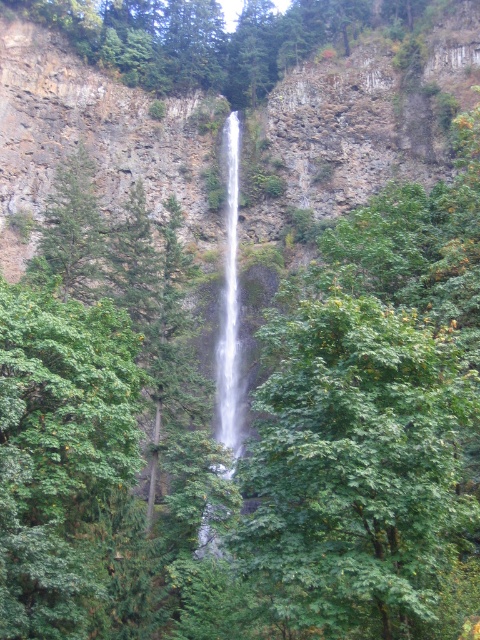
You are a drone operator trying to capture the waterfall. Your drone is currently at the coordinates where the clear water at center is located. You need to move it 0.1 units to the right and 0.1 units down. What are the new coordinates?

The clear water at center is at point (229, 308). Moving 0.1 units to the right increases the x coordinate to 0.584, and moving 0.1 units down increases the y coordinate to 0.579. The new coordinates are (277, 372).

You are a hiker standing near the base of the waterfall. You want to place a 60 cm long measuring stick horizontally between the clear water at center and the white smooth waterfall at center. Will the measuring stick fit without overlapping either object?

The clear water at center is 59.90 centimeters from the white smooth waterfall at center. Since the measuring stick is 60 cm long, it will not fit as the distance is slightly less than the required length. The stick would overlap both objects.